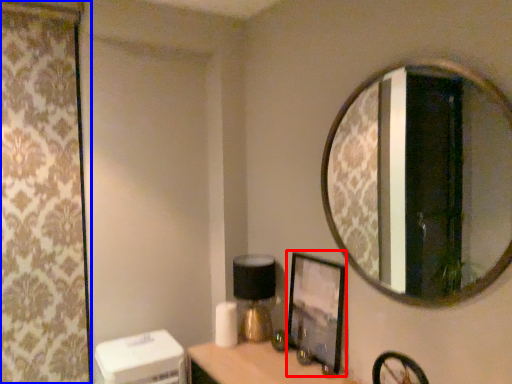
Question: Which point is further to the camera, picture frame (highlighted by a red box) or curtain (highlighted by a blue box)?

Choices:
 (A) picture frame
 (B) curtain

Answer: (B)